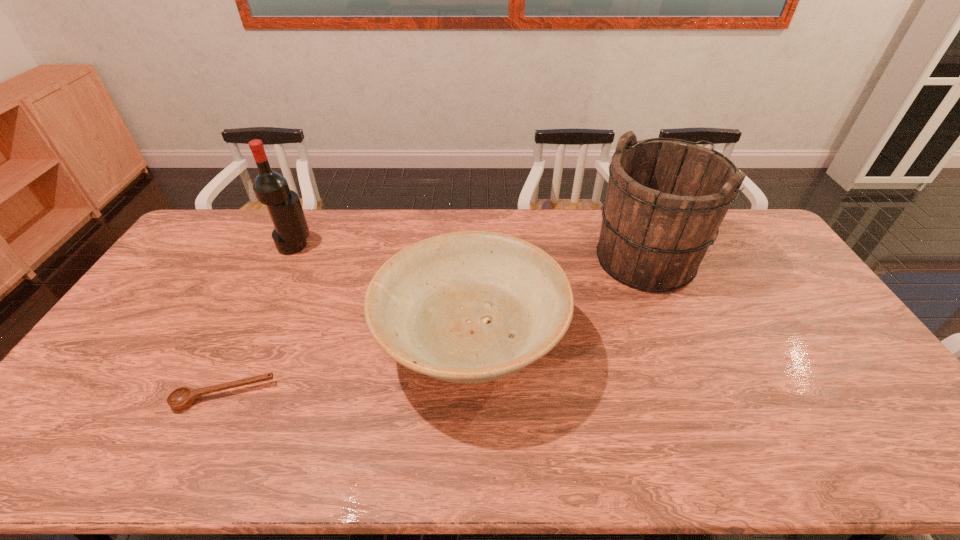
At what (x,y) coordinates should I click in order to perform the action: click on bucket. Please return your answer as a coordinate pair (x, y). The image size is (960, 540). Looking at the image, I should click on (665, 201).

The image size is (960, 540). I want to click on wine bottle, so click(x=271, y=188).

This screenshot has height=540, width=960. Identify the location of the third object from left to right. (470, 307).

Where is `the third tallest object`? the third tallest object is located at coordinates (470, 307).

I want to click on the shortest object, so pos(182,398).

The width and height of the screenshot is (960, 540). I want to click on vacant space located 0.330m on the front of the rightmost object, so click(699, 389).

Locate an element on the screen. The width and height of the screenshot is (960, 540). free space located 0.220m on the front of the wine bottle is located at coordinates (269, 301).

Locate an element on the screen. free spot located 0.200m on the right of the dish is located at coordinates (633, 344).

Locate an element on the screen. The height and width of the screenshot is (540, 960). blank space located 0.180m on the left of the shortest object is located at coordinates (106, 395).

I want to click on bucket located at the far edge, so click(665, 201).